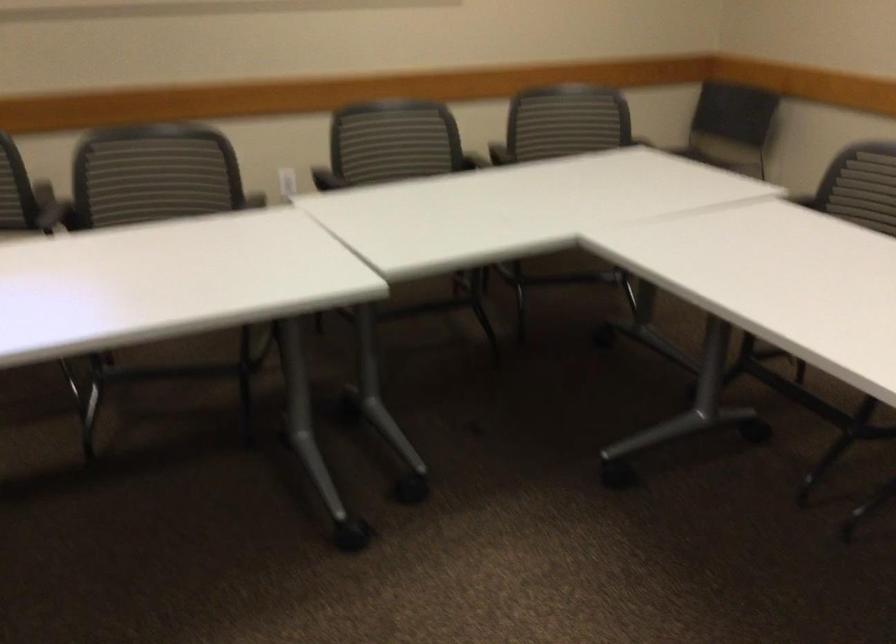
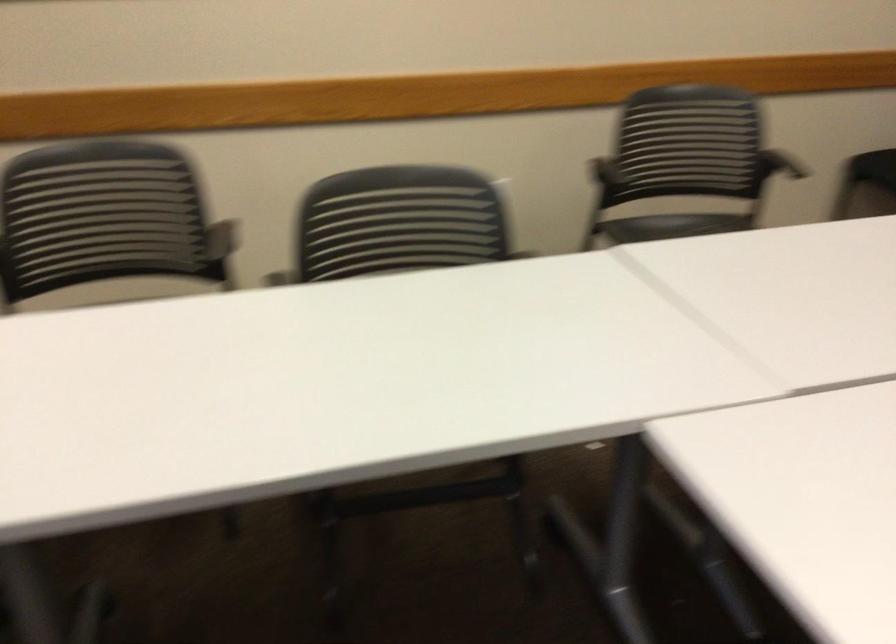
Looking at this image, the first image is from the beginning of the video and the second image is from the end. How did the camera likely rotate when shooting the video?

The camera rotated toward right-down.